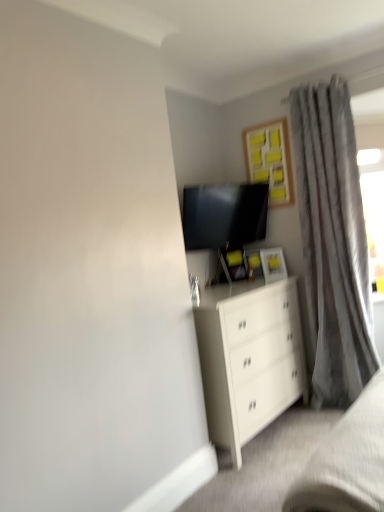
This screenshot has width=384, height=512. What do you see at coordinates (249, 358) in the screenshot?
I see `white matte chest of drawers at center` at bounding box center [249, 358].

This screenshot has height=512, width=384. Describe the element at coordinates (270, 160) in the screenshot. I see `wooden frame with yellow sticky notes at upper center` at that location.

I want to click on white matte bed frame at lower right, so click(x=347, y=461).

How far apart are matte black tv at upper center and gray textured curtain at right?

matte black tv at upper center and gray textured curtain at right are 24.89 inches apart.

From the image's perspective, between matte black tv at upper center and gray textured curtain at right, who is located below?

gray textured curtain at right, from the image's perspective.

Is matte black tv at upper center outside of gray textured curtain at right?

That's correct, matte black tv at upper center is outside of gray textured curtain at right.

Consider the image. Is matte black tv at upper center not close to gray textured curtain at right?

No, matte black tv at upper center is not far from gray textured curtain at right.

Considering the sizes of gray textured curtain at right and white matte chest of drawers at center in the image, is gray textured curtain at right taller or shorter than white matte chest of drawers at center?

Clearly, gray textured curtain at right is taller compared to white matte chest of drawers at center.

Do you think gray textured curtain at right is within white matte chest of drawers at center, or outside of it?

gray textured curtain at right is not inside white matte chest of drawers at center, it's outside.

Does gray textured curtain at right turn towards white matte chest of drawers at center?

No, gray textured curtain at right does not turn towards white matte chest of drawers at center.

From the picture: From the image's perspective, is gray textured curtain at right on white matte chest of drawers at center?

Yes, from the image's perspective, gray textured curtain at right is on top of white matte chest of drawers at center.

Considering the relative sizes of white matte chest of drawers at center and wooden frame with yellow sticky notes at upper center in the image provided, is white matte chest of drawers at center bigger than wooden frame with yellow sticky notes at upper center?

Yes, white matte chest of drawers at center is bigger than wooden frame with yellow sticky notes at upper center.

Does white matte chest of drawers at center have a greater width compared to wooden frame with yellow sticky notes at upper center?

Correct, the width of white matte chest of drawers at center exceeds that of wooden frame with yellow sticky notes at upper center.

How many degrees apart are the facing directions of white matte chest of drawers at center and wooden frame with yellow sticky notes at upper center?

87.7 degrees.

From a real-world perspective, does white matte bed frame at lower right stand above wooden frame with yellow sticky notes at upper center?

No, from a real-world perspective, white matte bed frame at lower right is not above wooden frame with yellow sticky notes at upper center.

Considering the relative sizes of white matte bed frame at lower right and wooden frame with yellow sticky notes at upper center in the image provided, is white matte bed frame at lower right bigger than wooden frame with yellow sticky notes at upper center?

Yes, white matte bed frame at lower right is bigger than wooden frame with yellow sticky notes at upper center.

Choose the correct answer: Is white matte bed frame at lower right inside wooden frame with yellow sticky notes at upper center or outside it?

white matte bed frame at lower right is spatially situated outside wooden frame with yellow sticky notes at upper center.

Is white matte bed frame at lower right in front of wooden frame with yellow sticky notes at upper center?

Yes.

Consider the image. Is white matte bed frame at lower right positioned beyond the bounds of gray textured curtain at right?

Yes.

Is white matte bed frame at lower right facing away from gray textured curtain at right?

No, white matte bed frame at lower right's orientation is not away from gray textured curtain at right.

From a real-world perspective, which is physically below, white matte bed frame at lower right or gray textured curtain at right?

In real-world perspective, white matte bed frame at lower right is lower.

Is matte black tv at upper center beside white matte chest of drawers at center?

No, matte black tv at upper center is not with white matte chest of drawers at center.

Who is taller, matte black tv at upper center or white matte chest of drawers at center?

white matte chest of drawers at center.

Is point (197, 214) more distant than point (213, 314)?

Yes, it is.

In the scene shown: Is matte black tv at upper center facing away from white matte chest of drawers at center?

matte black tv at upper center does not have its back to white matte chest of drawers at center.

From the picture: Considering the sizes of matte black tv at upper center and wooden frame with yellow sticky notes at upper center in the image, is matte black tv at upper center taller or shorter than wooden frame with yellow sticky notes at upper center?

Considering their sizes, matte black tv at upper center has less height than wooden frame with yellow sticky notes at upper center.

Is matte black tv at upper center smaller than wooden frame with yellow sticky notes at upper center?

No.

From a real-world perspective, is matte black tv at upper center on wooden frame with yellow sticky notes at upper center?

No, from a real-world perspective, matte black tv at upper center is not on top of wooden frame with yellow sticky notes at upper center.

Find the location of a particular element. The image size is (384, 512). television below the wooden frame with yellow sticky notes at upper center (from the image's perspective) is located at coordinates pos(224,215).

In the image, there is a matte black tv at upper center. Where is `curtain below it (from a real-world perspective)`? The height and width of the screenshot is (512, 384). curtain below it (from a real-world perspective) is located at coordinates (333, 242).

Locate an element on the screen. This screenshot has width=384, height=512. chest of drawers on the left of gray textured curtain at right is located at coordinates (249, 358).

Looking at the image, which one is located closer to gray textured curtain at right, white matte bed frame at lower right or wooden frame with yellow sticky notes at upper center?

wooden frame with yellow sticky notes at upper center.

Based on their spatial positions, is white matte chest of drawers at center or matte black tv at upper center further from white matte bed frame at lower right?

matte black tv at upper center.

Estimate the real-world distances between objects in this image. Which object is closer to gray textured curtain at right, matte black tv at upper center or wooden frame with yellow sticky notes at upper center?

The object closer to gray textured curtain at right is wooden frame with yellow sticky notes at upper center.

Considering their positions, is wooden frame with yellow sticky notes at upper center positioned further to matte black tv at upper center than white matte bed frame at lower right?

Among the two, white matte bed frame at lower right is located further to matte black tv at upper center.

Looking at the image, which one is located further to gray textured curtain at right, wooden frame with yellow sticky notes at upper center or white matte chest of drawers at center?

white matte chest of drawers at center.

Considering their positions, is gray textured curtain at right positioned further to wooden frame with yellow sticky notes at upper center than white matte chest of drawers at center?

Based on the image, white matte chest of drawers at center appears to be further to wooden frame with yellow sticky notes at upper center.

From the image, which object appears to be nearer to white matte bed frame at lower right, gray textured curtain at right or white matte chest of drawers at center?

white matte chest of drawers at center is positioned closer to the anchor white matte bed frame at lower right.

Considering their positions, is matte black tv at upper center positioned further to white matte chest of drawers at center than gray textured curtain at right?

The object further to white matte chest of drawers at center is matte black tv at upper center.

This screenshot has height=512, width=384. I want to click on television between white matte bed frame at lower right and wooden frame with yellow sticky notes at upper center from front to back, so click(224, 215).

Locate an element on the screen. The height and width of the screenshot is (512, 384). television that lies between wooden frame with yellow sticky notes at upper center and white matte chest of drawers at center from top to bottom is located at coordinates (224, 215).

The height and width of the screenshot is (512, 384). In order to click on the chest of drawers located between white matte bed frame at lower right and gray textured curtain at right in the depth direction in this screenshot , I will do `click(249, 358)`.

I want to click on the chest of drawers positioned between white matte bed frame at lower right and matte black tv at upper center from near to far, so click(249, 358).